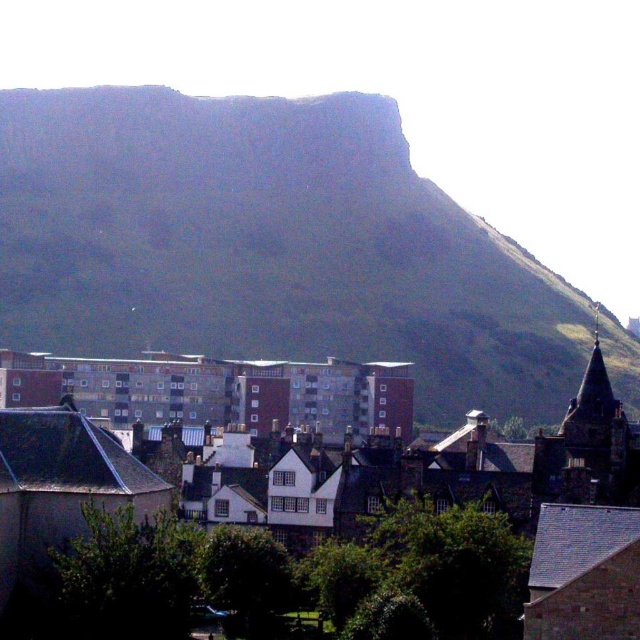
Question: Which object is closer to the camera taking this photo?

Choices:
 (A) brown brick town at center
 (B) brick apartment building at center

Answer: (A)

Question: Is green grassy hill at upper center smaller than brick apartment building at center?

Choices:
 (A) no
 (B) yes

Answer: (A)

Question: Is green grassy hill at upper center below brown brick town at center?

Choices:
 (A) no
 (B) yes

Answer: (A)

Question: Which object is closer to the camera taking this photo?

Choices:
 (A) brown brick town at center
 (B) green grassy hill at upper center
 (C) brick apartment building at center

Answer: (A)

Question: From the image, what is the correct spatial relationship of green grassy hill at upper center in relation to brown brick town at center?

Choices:
 (A) above
 (B) below

Answer: (A)

Question: Considering the real-world distances, which object is farthest from the brown brick town at center?

Choices:
 (A) brick apartment building at center
 (B) green grassy hill at upper center

Answer: (B)